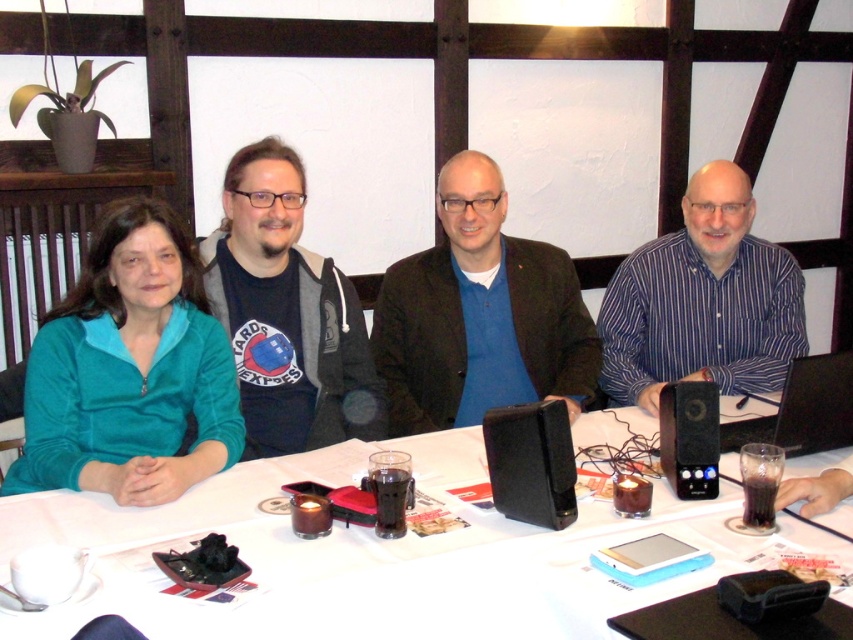
Is white paper table at center to the left of blue striped shirt at center from the viewer's perspective?

Yes, white paper table at center is to the left of blue striped shirt at center.

Is point (271, 528) in front of point (657, 323)?

That is True.

The width and height of the screenshot is (853, 640). Identify the location of white paper table at center. (351, 552).

In the scene shown: Is white paper table at center further to camera compared to black plastic laptop at right?

No, it is in front of black plastic laptop at right.

Is point (250, 628) positioned behind point (808, 403)?

No, (250, 628) is closer to viewer.

Is point (239, 634) positioned after point (808, 412)?

No, (239, 634) is closer to viewer.

This screenshot has height=640, width=853. Identify the location of white paper table at center. (351, 552).

Between blue striped shirt at center and black leather speaker at center, which one has more height?

With more height is blue striped shirt at center.

Where is `blue striped shirt at center`? This screenshot has width=853, height=640. blue striped shirt at center is located at coordinates [701, 301].

Find the location of a particular element. blue striped shirt at center is located at coordinates (701, 301).